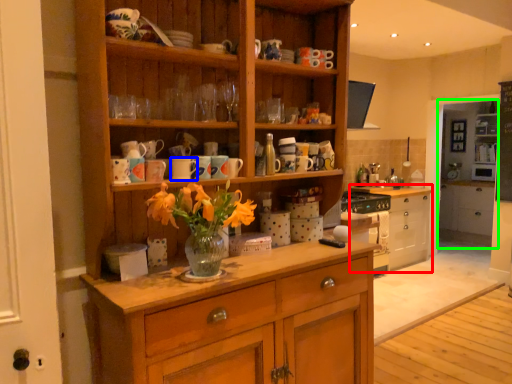
Question: Estimate the real-world distances between objects in this image. Which object is farther from chest of drawers (highlighted by a red box), mug (highlighted by a blue box) or shelf (highlighted by a green box)?

Choices:
 (A) mug
 (B) shelf

Answer: (A)